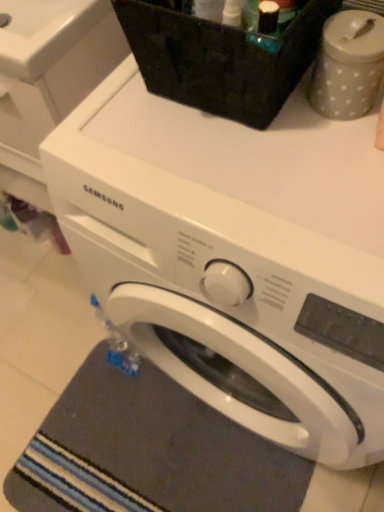
Locate an element on the screen. Image resolution: width=384 pixels, height=512 pixels. vacant area that is in front of gray dotted container at upper right is located at coordinates (330, 189).